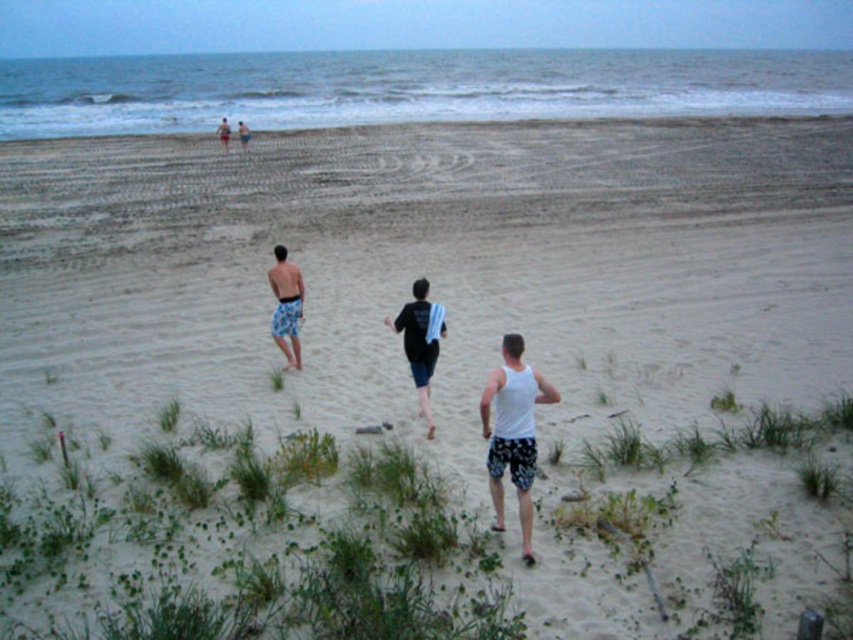
You are trying to decide which pair of shorts to wear for a beach walk. You have the dark blue denim shorts at center and the blue printed shorts at center. Which pair is narrower?

The dark blue denim shorts at center has a lesser width compared to the blue printed shorts at center, so the dark blue denim shorts at center is narrower.